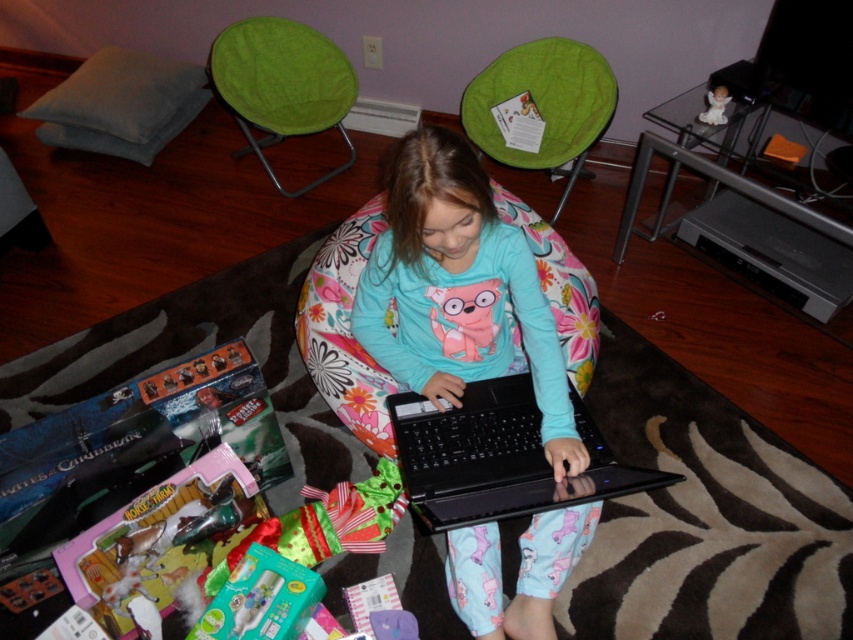
Question: Observing the image, what is the correct spatial positioning of floral fabric bean bag at center in reference to white porcelain angel at upper right?

Choices:
 (A) left
 (B) right

Answer: (A)

Question: Which point is closer to the camera?

Choices:
 (A) (712, 118)
 (B) (479, 531)
 (C) (416, 508)
 (D) (287, 600)

Answer: (C)

Question: Which of these objects is positioned farthest from the white porcelain angel at upper right?

Choices:
 (A) teal plastic toothbrush at lower center
 (B) black plastic laptop at center
 (C) matte blue fabric at center
 (D) floral fabric bean bag at center

Answer: (A)

Question: Considering the relative positions of black plastic laptop at center and white porcelain angel at upper right in the image provided, where is black plastic laptop at center located with respect to white porcelain angel at upper right?

Choices:
 (A) right
 (B) left

Answer: (B)

Question: Is black plastic laptop at center thinner than floral fabric bean bag at center?

Choices:
 (A) yes
 (B) no

Answer: (B)

Question: Which object is positioned farthest from the black plastic laptop at center?

Choices:
 (A) matte blue fabric at center
 (B) floral fabric bean bag at center
 (C) teal plastic toothbrush at lower center
 (D) white porcelain angel at upper right

Answer: (D)